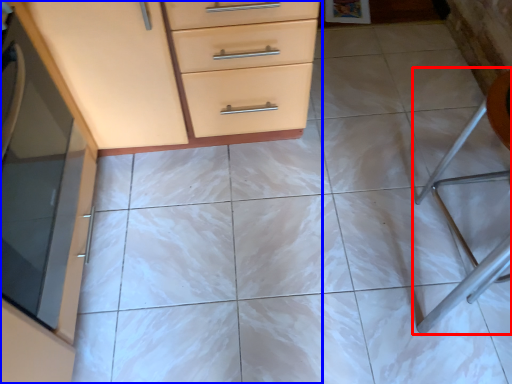
Question: Among these objects, which one is nearest to the camera, folding chair (highlighted by a red box) or chest of drawers (highlighted by a blue box)?

Choices:
 (A) folding chair
 (B) chest of drawers

Answer: (B)